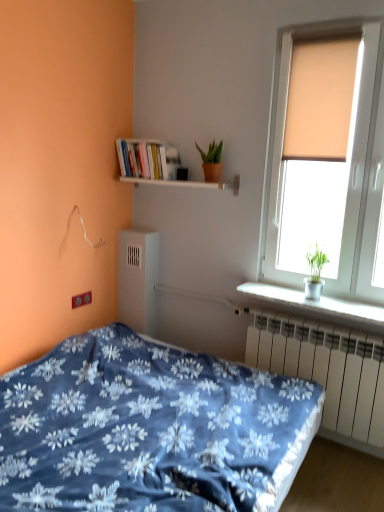
Describe the element at coordinates (350, 168) in the screenshot. I see `matte beige window at upper right` at that location.

Image resolution: width=384 pixels, height=512 pixels. What do you see at coordinates (328, 374) in the screenshot?
I see `white metallic radiator at lower right` at bounding box center [328, 374].

Describe the element at coordinates (211, 161) in the screenshot. I see `matte orange pot at upper center` at that location.

Image resolution: width=384 pixels, height=512 pixels. What do you see at coordinates (174, 183) in the screenshot?
I see `white wooden shelf at upper center, the 1th window sill viewed from the left` at bounding box center [174, 183].

At what (x,y) coordinates should I click in order to perform the action: click on white plastic pot at right, the first window sill in the bottom-to-top sequence. Please return your answer as a coordinate pair (x, y). Looking at the image, I should click on (315, 302).

What do you see at coordinates (315, 302) in the screenshot? I see `white plastic pot at right, which is counted as the 1th window sill, starting from the right` at bounding box center [315, 302].

Image resolution: width=384 pixels, height=512 pixels. What do you see at coordinates (147, 159) in the screenshot?
I see `hardcover books at upper left` at bounding box center [147, 159].

At what (x,y) coordinates should I click in order to perform the action: click on beige fabric curtain at upper right. Please return your answer as a coordinate pair (x, y). Looking at the image, I should click on (320, 99).

Is matte orange pot at upper center outside of white metallic radiator at lower right?

matte orange pot at upper center is positioned outside white metallic radiator at lower right.

What are the coordinates of `houseplant behind the white metallic radiator at lower right` in the screenshot? It's located at (211, 161).

From a real-world perspective, between matte orange pot at upper center and white metallic radiator at lower right, who is vertically lower?

From a 3D spatial view, white metallic radiator at lower right is below.

Would you say white metallic radiator at lower right is to the left or to the right of matte beige window at upper right in the picture?

From the image, it's evident that white metallic radiator at lower right is to the left of matte beige window at upper right.

Is white metallic radiator at lower right positioned behind matte beige window at upper right?

Yes, white metallic radiator at lower right is further from the viewer.

Which of these two, white metallic radiator at lower right or matte beige window at upper right, stands taller?

With more height is matte beige window at upper right.

Could you tell me if white plastic pot at right, which is counted as the 1th window sill, starting from the right, is facing beige fabric curtain at upper right?

No, white plastic pot at right, which is counted as the 1th window sill, starting from the right, does not turn towards beige fabric curtain at upper right.

At what (x,y) coordinates should I click in order to perform the action: click on the 1st window sill to the left when counting from the beige fabric curtain at upper right. Please return your answer as a coordinate pair (x, y). The height and width of the screenshot is (512, 384). Looking at the image, I should click on (315, 302).

Consider the image. From a real-world perspective, is white plastic pot at right, the 2th window sill when ordered from top to bottom, above or below beige fabric curtain at upper right?

In terms of real-world spatial position, white plastic pot at right, the 2th window sill when ordered from top to bottom, is below beige fabric curtain at upper right.

Based on their sizes in the image, would you say white plastic pot at right, the 2th window sill when ordered from top to bottom, is bigger or smaller than beige fabric curtain at upper right?

white plastic pot at right, the 2th window sill when ordered from top to bottom, is smaller than beige fabric curtain at upper right.

From the image's perspective, would you say matte beige window at upper right is shown under hardcover books at upper left?

Yes, from the image's perspective, matte beige window at upper right is below hardcover books at upper left.

This screenshot has height=512, width=384. I want to click on window in front of the hardcover books at upper left, so click(x=350, y=168).

Considering the relative sizes of matte beige window at upper right and hardcover books at upper left in the image provided, is matte beige window at upper right thinner than hardcover books at upper left?

Yes.

Consider the image. Is matte beige window at upper right looking in the opposite direction of hardcover books at upper left?

No, matte beige window at upper right is not facing away from hardcover books at upper left.

From a real-world perspective, is hardcover books at upper left over white plastic pot at right, the 2th window sill when ordered from top to bottom?

Yes, from a real-world perspective, hardcover books at upper left is above white plastic pot at right, the 2th window sill when ordered from top to bottom.

In the scene shown: Are hardcover books at upper left and white plastic pot at right, which is counted as the 1th window sill, starting from the right, beside each other?

hardcover books at upper left and white plastic pot at right, which is counted as the 1th window sill, starting from the right, are clearly separated.

Is hardcover books at upper left oriented towards white plastic pot at right, which is the second window sill in left-to-right order?

No, hardcover books at upper left is not aimed at white plastic pot at right, which is the second window sill in left-to-right order.

Between hardcover books at upper left and white plastic pot at right, which is the second window sill in left-to-right order, which one has more height?

hardcover books at upper left.

From a real-world perspective, is hardcover books at upper left above or below blue floral fabric bed at lower left?

In terms of real-world spatial position, hardcover books at upper left is above blue floral fabric bed at lower left.

Is hardcover books at upper left thinner than blue floral fabric bed at lower left?

Yes.

Is hardcover books at upper left not within blue floral fabric bed at lower left?

Absolutely, hardcover books at upper left is external to blue floral fabric bed at lower left.

You are a GUI agent. You are given a task and a screenshot of the screen. Output one action in this format:
    pyautogui.click(x=<x>, y=<y>)
    Task: Click on the bed that appears below the hardcover books at upper left (from the image's perspective)
    The width and height of the screenshot is (384, 512).
    Given the screenshot: What is the action you would take?
    pos(149,429)

Can we say white wooden shelf at upper center, positioned as the first window sill in top-to-bottom order, lies outside beige fabric curtain at upper right?

Yes, white wooden shelf at upper center, positioned as the first window sill in top-to-bottom order, is outside of beige fabric curtain at upper right.

From the image's perspective, between white wooden shelf at upper center, arranged as the 2th window sill when ordered from the bottom, and beige fabric curtain at upper right, which one is located above?

beige fabric curtain at upper right appears higher in the image.

Between white wooden shelf at upper center, positioned as the first window sill in top-to-bottom order, and beige fabric curtain at upper right, which one has smaller width?

Thinner between the two is beige fabric curtain at upper right.

From their relative heights in the image, would you say white wooden shelf at upper center, positioned as the first window sill in top-to-bottom order, is taller or shorter than beige fabric curtain at upper right?

Clearly, white wooden shelf at upper center, positioned as the first window sill in top-to-bottom order, is shorter compared to beige fabric curtain at upper right.

You are a GUI agent. You are given a task and a screenshot of the screen. Output one action in this format:
    pyautogui.click(x=<x>, y=<y>)
    Task: Click on the radiator that appears below the matte orange pot at upper center (from a real-world perspective)
    This screenshot has height=512, width=384.
    Given the screenshot: What is the action you would take?
    pyautogui.click(x=328, y=374)

At what (x,y) coordinates should I click in order to perform the action: click on window above the white metallic radiator at lower right (from a real-world perspective). Please return your answer as a coordinate pair (x, y). Looking at the image, I should click on (350, 168).

When comparing their distances from beige fabric curtain at upper right, does blue floral fabric bed at lower left or hardcover books at upper left seem further?

Among the two, blue floral fabric bed at lower left is located further to beige fabric curtain at upper right.

Consider the image. Based on their spatial positions, is matte beige window at upper right or beige fabric curtain at upper right closer to white metallic radiator at lower right?

matte beige window at upper right lies closer to white metallic radiator at lower right than the other object.

Estimate the real-world distances between objects in this image. Which object is closer to white plastic pot at right, which is counted as the 1th window sill, starting from the right, white wooden shelf at upper center, marked as the second window sill in a right-to-left arrangement, or white metallic radiator at lower right?

Based on the image, white metallic radiator at lower right appears to be nearer to white plastic pot at right, which is counted as the 1th window sill, starting from the right.

Estimate the real-world distances between objects in this image. Which object is closer to white metallic radiator at lower right, white wooden shelf at upper center, arranged as the 2th window sill when ordered from the bottom, or white plastic pot at right, which is counted as the 1th window sill, starting from the right?

white plastic pot at right, which is counted as the 1th window sill, starting from the right, lies closer to white metallic radiator at lower right than the other object.

In the scene shown: Which object lies further to the anchor point white wooden shelf at upper center, marked as the second window sill in a right-to-left arrangement, blue floral fabric bed at lower left or white plastic pot at right, the 2th window sill when ordered from top to bottom?

blue floral fabric bed at lower left lies further to white wooden shelf at upper center, marked as the second window sill in a right-to-left arrangement, than the other object.

Based on the photo, looking at the image, which one is located further to beige fabric curtain at upper right, matte orange pot at upper center or white plastic pot at right, the 2th window sill when ordered from top to bottom?

white plastic pot at right, the 2th window sill when ordered from top to bottom, is further to beige fabric curtain at upper right.

Looking at the image, which one is located further to white wooden shelf at upper center, marked as the second window sill in a right-to-left arrangement, matte beige window at upper right or beige fabric curtain at upper right?

Based on the image, beige fabric curtain at upper right appears to be further to white wooden shelf at upper center, marked as the second window sill in a right-to-left arrangement.

Estimate the real-world distances between objects in this image. Which object is further from white plastic pot at right, which is counted as the 1th window sill, starting from the right, hardcover books at upper left or beige fabric curtain at upper right?

hardcover books at upper left lies further to white plastic pot at right, which is counted as the 1th window sill, starting from the right, than the other object.

I want to click on window sill between white wooden shelf at upper center, positioned as the first window sill in top-to-bottom order, and matte beige window at upper right from left to right, so click(315, 302).

This screenshot has width=384, height=512. I want to click on window sill between hardcover books at upper left and white plastic pot at right, which is counted as the 1th window sill, starting from the right, from left to right, so click(174, 183).

Find the location of `radiator between blue floral fabric bed at lower left and hardcover books at upper left in the front-back direction`. radiator between blue floral fabric bed at lower left and hardcover books at upper left in the front-back direction is located at coordinates (328, 374).

Identify the location of radiator between matte beige window at upper right and blue floral fabric bed at lower left in the vertical direction. Image resolution: width=384 pixels, height=512 pixels. (328, 374).